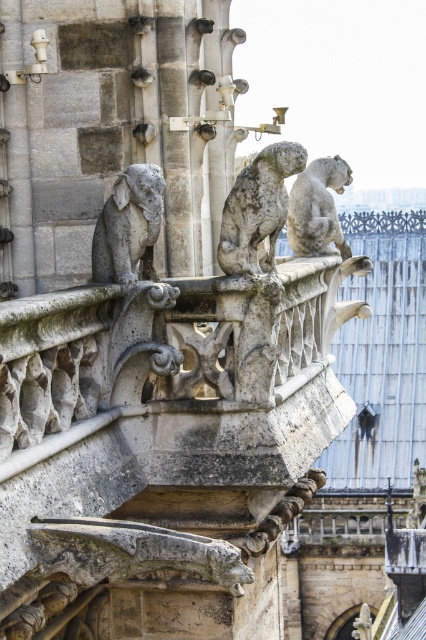
Question: Among these points, which one is farthest from the camera?

Choices:
 (A) (328, 248)
 (B) (123, 300)
 (C) (247, 227)

Answer: (A)

Question: Is gray stone gargoyle at center positioned in front of stone gargoyle at center?

Choices:
 (A) yes
 (B) no

Answer: (A)

Question: Which point is closer to the camera?

Choices:
 (A) stone gargoyle at center
 (B) gray stone gargoyle at upper left
 (C) gray stone gargoyle at upper right

Answer: (B)

Question: Is gray stone gargoyle at center behind gray stone gargoyle at upper right?

Choices:
 (A) yes
 (B) no

Answer: (B)

Question: Is gray stone gargoyle at center to the left of gray stone gargoyle at upper right from the viewer's perspective?

Choices:
 (A) yes
 (B) no

Answer: (A)

Question: Which point is closer to the camera taking this photo?

Choices:
 (A) (141, 188)
 (B) (307, 220)
 (C) (123, 204)
 (D) (236, 257)

Answer: (A)